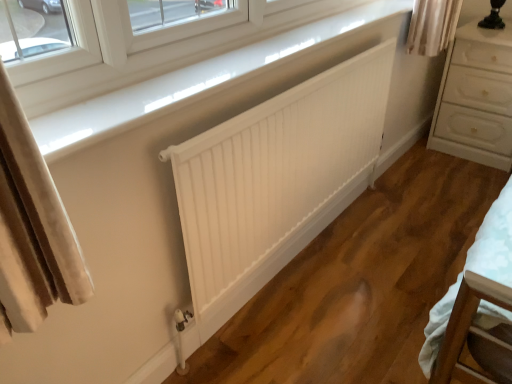
Question: Would you say white glossy window sill at upper center is to the left or to the right of white glossy chest of drawers at right in the picture?

Choices:
 (A) left
 (B) right

Answer: (A)

Question: Does point (165, 64) appear closer or farther from the camera than point (484, 52)?

Choices:
 (A) closer
 (B) farther

Answer: (A)

Question: Estimate the real-world distances between objects in this image. Which object is closer to the white glossy chest of drawers at right?

Choices:
 (A) white matte radiator at center
 (B) white glossy window sill at upper center

Answer: (A)

Question: Which object is positioned farthest from the white matte radiator at center?

Choices:
 (A) white glossy window sill at upper center
 (B) white glossy chest of drawers at right

Answer: (B)